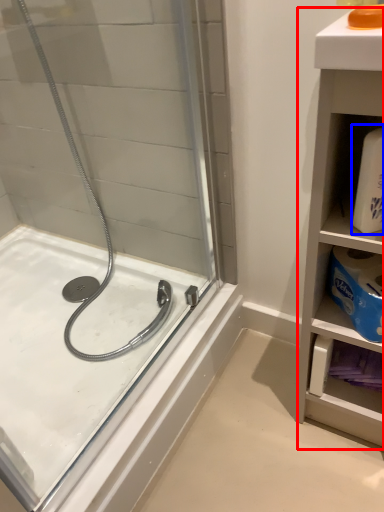
Question: Among these objects, which one is nearest to the camera, bathroom cabinet (highlighted by a red box) or cleaning product (highlighted by a blue box)?

Choices:
 (A) bathroom cabinet
 (B) cleaning product

Answer: (A)